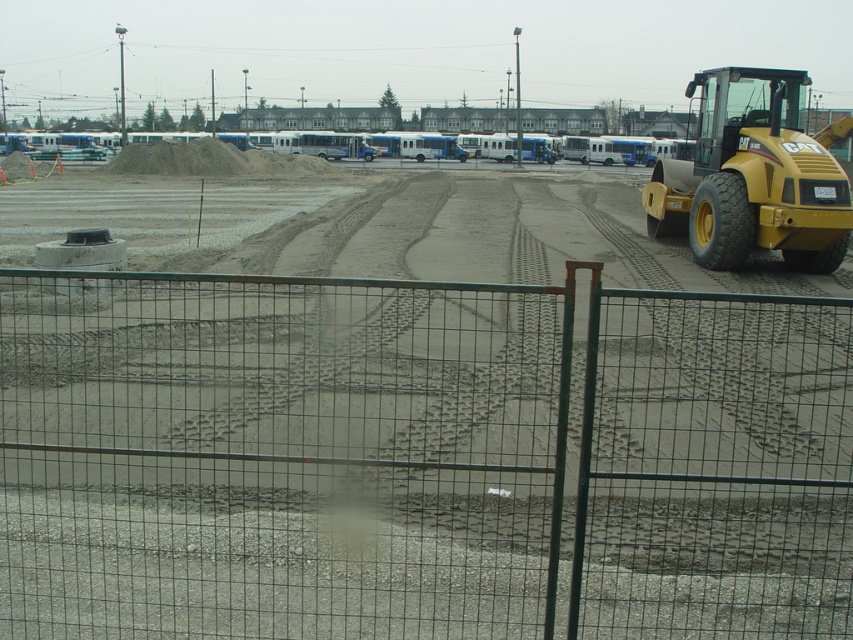
Does green wire mesh fence at center lie behind yellow rubber tractor at right?

No.

Who is shorter, green wire mesh fence at center or yellow rubber tractor at right?

green wire mesh fence at center is shorter.

I want to click on green wire mesh fence at center, so click(419, 460).